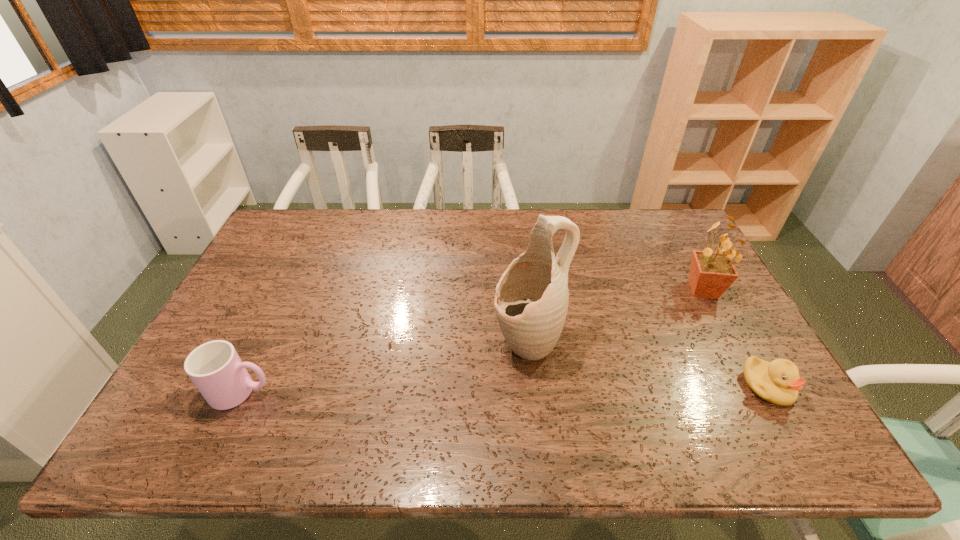
I want to click on blank space located 0.370m at the front of the third shortest object with flowers visible, so click(x=607, y=360).

The image size is (960, 540). In order to click on free space located at the spout of the tallest object in this screenshot , I will do `click(395, 408)`.

The width and height of the screenshot is (960, 540). In order to click on vacant space located 0.170m at the spout of the tallest object in this screenshot , I will do `click(441, 385)`.

Find the location of a particular element. This screenshot has height=540, width=960. free point located 0.140m at the spout of the tallest object is located at coordinates (451, 380).

The height and width of the screenshot is (540, 960). Find the location of `cup located in the near edge section of the desktop`. cup located in the near edge section of the desktop is located at coordinates (215, 368).

In order to click on duckling that is at the near edge in this screenshot , I will do `click(778, 382)`.

This screenshot has width=960, height=540. In order to click on object that is at the left edge in this screenshot , I will do `click(215, 368)`.

You are a GUI agent. You are given a task and a screenshot of the screen. Output one action in this format:
    pyautogui.click(x=<x>, y=<y>)
    Task: Click on the duckling situated at the right edge
    
    Given the screenshot: What is the action you would take?
    pyautogui.click(x=778, y=382)

Where is `sunflower that is at the right edge`? This screenshot has height=540, width=960. sunflower that is at the right edge is located at coordinates 711,273.

Identify the location of object that is positioned at the near left corner. (215, 368).